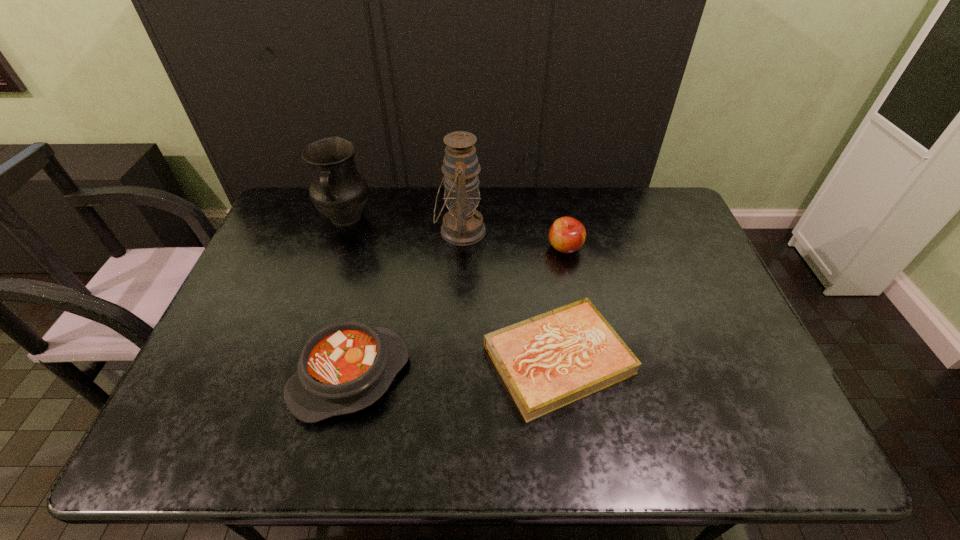
Find the location of a particular element. This screenshot has height=540, width=960. the tallest object is located at coordinates (463, 225).

Identify the location of the fourth shortest object. (338, 190).

The height and width of the screenshot is (540, 960). Identify the location of apple. coord(567,235).

Identify the location of casserole. (347, 366).

In order to click on the shortest object in this screenshot , I will do `click(549, 361)`.

At what (x,y) coordinates should I click in order to perform the action: click on vacant space located on the front of the oil lamp. Please return your answer as a coordinate pair (x, y). This screenshot has height=540, width=960. Looking at the image, I should click on (459, 275).

Find the location of a particular element. The image size is (960, 540). blank space located 0.320m on the handle side of the pitcher is located at coordinates (314, 314).

Image resolution: width=960 pixels, height=540 pixels. Identify the location of free location located 0.180m on the front of the apple. (576, 305).

Where is `free space located on the left of the casserole`? free space located on the left of the casserole is located at coordinates (259, 376).

The width and height of the screenshot is (960, 540). What are the coordinates of `vacant space located on the back of the shortest object` in the screenshot? It's located at (540, 232).